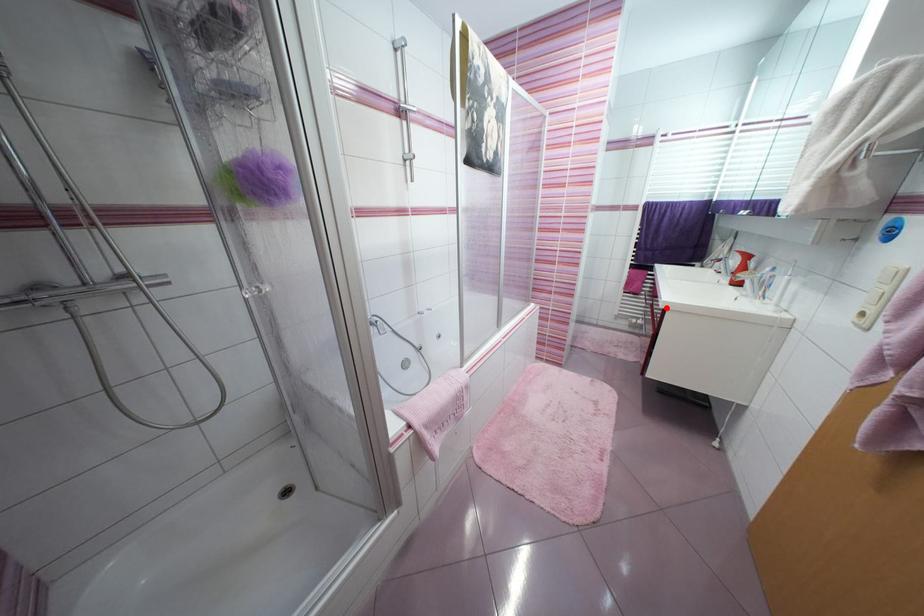
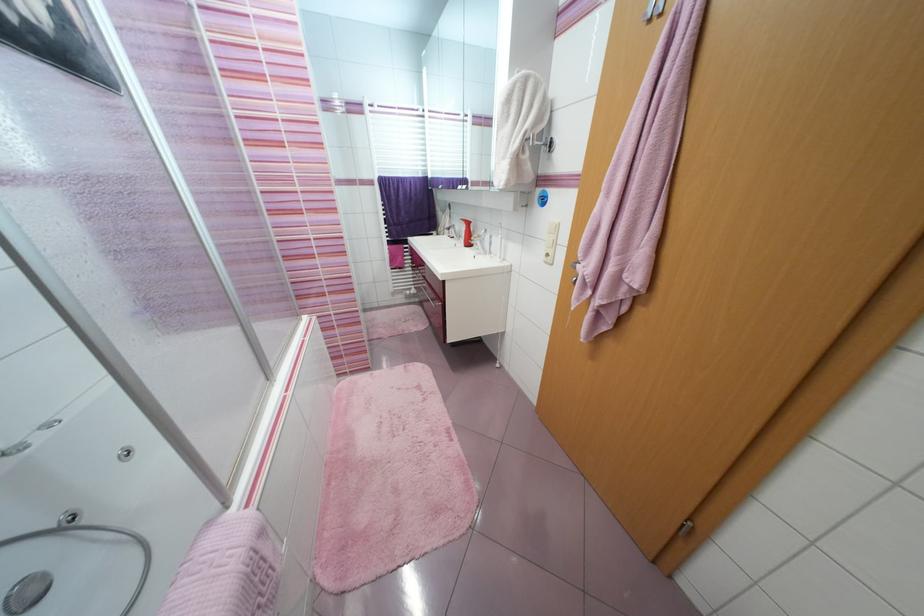
Locate, in the second image, the point that corresponds to the highlighted location in the first image.

(445, 281)